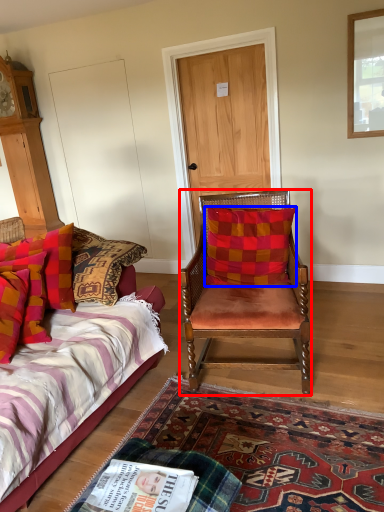
Question: Which of the following is the closest to the observer, chair (highlighted by a red box) or pillow (highlighted by a blue box)?

Choices:
 (A) chair
 (B) pillow

Answer: (A)